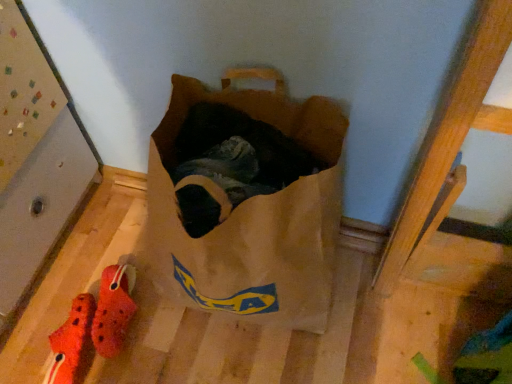
Locate an element on the screen. The image size is (512, 384). vacant space to the left of orange fabric slipper at lower left, the first footwear viewed from the left is located at coordinates (27, 345).